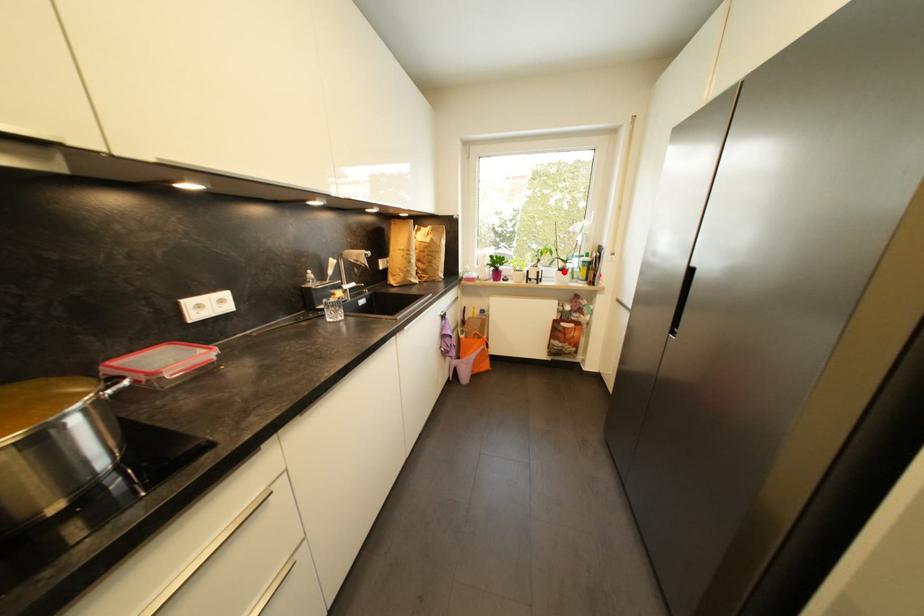
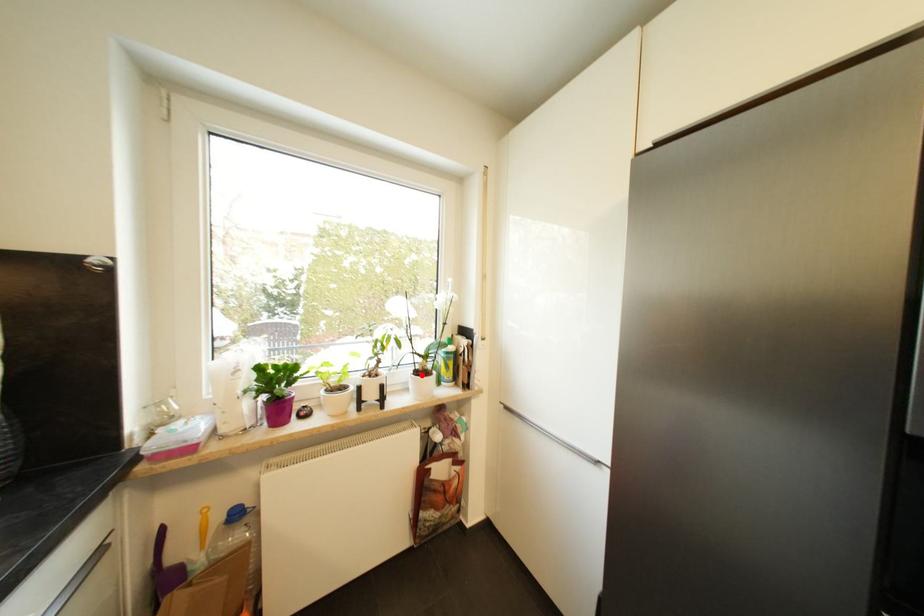
I am providing you with two images of the same scene from different viewpoints. A red point is marked on the first image and another point is marked on the second image. Is the red point in image1 aligned with the point shown in image2?

Yes